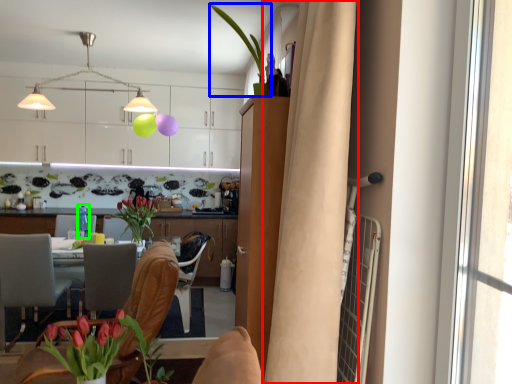
Question: Considering the real-world distances, which object is farthest from curtain (highlighted by a red box)? houseplant (highlighted by a blue box) or bottle (highlighted by a green box)?

Choices:
 (A) houseplant
 (B) bottle

Answer: (B)